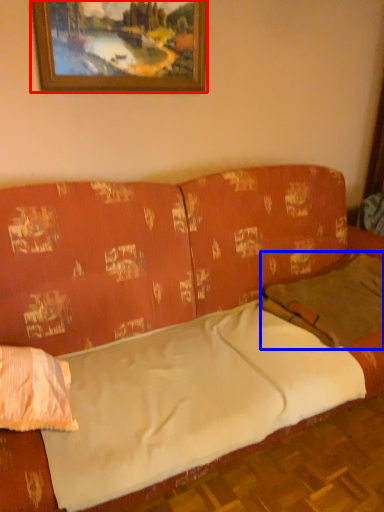
Question: Which of the following is the farthest to the observer, picture frame (highlighted by a red box) or pillow (highlighted by a blue box)?

Choices:
 (A) picture frame
 (B) pillow

Answer: (A)